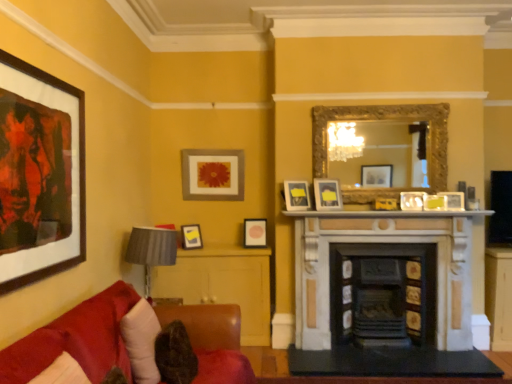
The height and width of the screenshot is (384, 512). I want to click on gray fabric lampshade at left, so click(151, 251).

Where is `matte white picture frame at center-right, which is counted as the first picture frame, starting from the right`? matte white picture frame at center-right, which is counted as the first picture frame, starting from the right is located at coordinates (453, 200).

What are the coordinates of `gray fabric lampshade at left` in the screenshot? It's located at (151, 251).

Is point (244, 235) positioned behind point (191, 234)?

Yes, point (244, 235) is behind point (191, 234).

From a real-world perspective, is matte black picture frame at center, the 5th picture frame viewed from the right, on top of matte black picture frame at center, acting as the 7th picture frame starting from the right?

Indeed, from a real-world perspective, matte black picture frame at center, the 5th picture frame viewed from the right, stands above matte black picture frame at center, acting as the 7th picture frame starting from the right.

Considering the relative sizes of matte black picture frame at center, the 5th picture frame viewed from the right, and matte black picture frame at center, placed as the third picture frame when sorted from back to front, in the image provided, is matte black picture frame at center, the 5th picture frame viewed from the right, taller than matte black picture frame at center, placed as the third picture frame when sorted from back to front,?

Indeed, matte black picture frame at center, the 5th picture frame viewed from the right, has a greater height compared to matte black picture frame at center, placed as the third picture frame when sorted from back to front.

Can you tell me how much matte black picture frame at center, marked as the fifth picture frame in a left-to-right arrangement, and gold ornate mirror at upper center differ in facing direction?

18.5 degrees separate the facing orientations of matte black picture frame at center, marked as the fifth picture frame in a left-to-right arrangement, and gold ornate mirror at upper center.

Can you confirm if matte black picture frame at center, which is the 4th picture frame from right to left, is taller than gold ornate mirror at upper center?

Incorrect, the height of matte black picture frame at center, which is the 4th picture frame from right to left, is not larger of that of gold ornate mirror at upper center.

Is matte black picture frame at center, marked as the fifth picture frame in a left-to-right arrangement, looking in the opposite direction of gold ornate mirror at upper center?

No, matte black picture frame at center, marked as the fifth picture frame in a left-to-right arrangement, is not facing away from gold ornate mirror at upper center.

Is matte black picture frame at center, which is counted as the 5th picture frame, starting from the back, outside of gold ornate mirror at upper center?

matte black picture frame at center, which is counted as the 5th picture frame, starting from the back, is positioned outside gold ornate mirror at upper center.

Considering the positions of points (317, 108) and (252, 338), is point (317, 108) farther from camera compared to point (252, 338)?

No.

Would you say gold ornate mirror at upper center is outside wooden cabinet at lower center, the 2th table from the front?

That's correct, gold ornate mirror at upper center is outside of wooden cabinet at lower center, the 2th table from the front.

Looking at this image, is wooden cabinet at lower center, the 2th table from the front, at the back of gold ornate mirror at upper center?

No, wooden cabinet at lower center, the 2th table from the front, is not at the back of gold ornate mirror at upper center.

From a real-world perspective, who is located lower, gold ornate mirror at upper center or wooden cabinet at lower center, which is counted as the second table, starting from the bottom?

wooden cabinet at lower center, which is counted as the second table, starting from the bottom, is physically lower.

Does black marble table at center, which is counted as the first table, starting from the right, appear on the right side of matte white picture frame at center, which appears as the fifth picture frame when viewed from the front?

No, black marble table at center, which is counted as the first table, starting from the right, is not to the right of matte white picture frame at center, which appears as the fifth picture frame when viewed from the front.

Does black marble table at center, which appears as the 1th table when viewed from the front, turn towards matte white picture frame at center, which appears as the fifth picture frame when viewed from the front?

No.

Consider the image. Is black marble table at center, which is counted as the 2th table, starting from the left, wider than matte white picture frame at center, which is counted as the 4th picture frame, starting from the back?

Yes.

Which object is more forward, black marble table at center, which is counted as the second table, starting from the top, or matte white picture frame at center, which appears as the fifth picture frame when viewed from the front?

black marble table at center, which is counted as the second table, starting from the top, is closer to the camera.

Where is `table in front of the wooden cabinet at lower center, the 2th table from the front`? The width and height of the screenshot is (512, 384). table in front of the wooden cabinet at lower center, the 2th table from the front is located at coordinates (356, 377).

Consider the image. Which is nearer, (253, 317) or (259, 356)?

The point (259, 356) is closer to the camera.

Does wooden cabinet at lower center, which is counted as the second table, starting from the bottom, have a lesser width compared to black marble table at center, which is counted as the first table, starting from the right?

Yes, wooden cabinet at lower center, which is counted as the second table, starting from the bottom, is thinner than black marble table at center, which is counted as the first table, starting from the right.

What's the angular difference between wooden cabinet at lower center, placed as the 1th table when sorted from top to bottom, and black marble table at center, which is counted as the 2th table, starting from the left,'s facing directions?

The angle between the facing direction of wooden cabinet at lower center, placed as the 1th table when sorted from top to bottom, and the facing direction of black marble table at center, which is counted as the 2th table, starting from the left, is 1.68 degrees.

Which is in front, matte black picture frame at center, the 7th picture frame when ordered from front to back, or white fabric pillow at lower left?

Positioned in front is white fabric pillow at lower left.

From the image's perspective, which one is positioned lower, matte black picture frame at center, the 5th picture frame viewed from the right, or white fabric pillow at lower left?

white fabric pillow at lower left.

Is matte black picture frame at center, the 7th picture frame when ordered from front to back, not near white fabric pillow at lower left?

That's right, there is a large distance between matte black picture frame at center, the 7th picture frame when ordered from front to back, and white fabric pillow at lower left.

Consider the image. Is matte black picture frame at center, the 4th picture frame viewed from the left, positioned with its back to white fabric pillow at lower left?

matte black picture frame at center, the 4th picture frame viewed from the left, does not have its back to white fabric pillow at lower left.

Which object is closer to the camera, matte black picture frame at left, acting as the first picture frame starting from the front, or matte black picture frame at center, which is counted as the 5th picture frame, starting from the back?

matte black picture frame at left, acting as the first picture frame starting from the front, is more forward.

Between matte black picture frame at left, placed as the first picture frame when sorted from left to right, and matte black picture frame at center, marked as the fifth picture frame in a left-to-right arrangement, which one appears on the left side from the viewer's perspective?

Positioned to the left is matte black picture frame at left, placed as the first picture frame when sorted from left to right.

Is matte black picture frame at left, placed as the first picture frame when sorted from left to right, next to matte black picture frame at center, which is the 4th picture frame from right to left?

No, matte black picture frame at left, placed as the first picture frame when sorted from left to right, is not in contact with matte black picture frame at center, which is the 4th picture frame from right to left.

The width and height of the screenshot is (512, 384). There is a matte black picture frame at left, arranged as the 8th picture frame when viewed from the right. What are the coordinates of `the 1st picture frame below it (from a real-world perspective)` in the screenshot? It's located at (297, 195).

In order to click on picture frame below the matte black picture frame at center, the 5th picture frame viewed from the right (from the image's perspective) in this screenshot , I will do `click(191, 236)`.

At what (x,y) coordinates should I click in order to perform the action: click on picture frame that is the 2nd one when counting forward from the gold ornate mirror at upper center. Please return your answer as a coordinate pair (x, y). This screenshot has width=512, height=384. Looking at the image, I should click on (297, 195).

Looking at the image, which one is located closer to matte black picture frame at left, positioned as the eighth picture frame in back-to-front order, matte black picture frame at center, the 4th picture frame viewed from the left, or dark gray stone fireplace at center, positioned as the first fireplace in right-to-left order?

matte black picture frame at center, the 4th picture frame viewed from the left, is positioned closer to the anchor matte black picture frame at left, positioned as the eighth picture frame in back-to-front order.

Based on their spatial positions, is dark gray stone fireplace at center, positioned as the first fireplace in right-to-left order, or gold ornate mirror at upper center further from white marble fireplace at center?

Based on the image, dark gray stone fireplace at center, positioned as the first fireplace in right-to-left order, appears to be further to white marble fireplace at center.

When comparing their distances from matte black picture frame at left, placed as the first picture frame when sorted from left to right, does gray fabric lampshade at left or matte white picture frame at center-right, the 8th picture frame positioned from the left, seem closer?

Based on the image, gray fabric lampshade at left appears to be nearer to matte black picture frame at left, placed as the first picture frame when sorted from left to right.

Looking at the image, which one is located further to matte white picture frame at center, marked as the 3th picture frame in a front-to-back arrangement, matte gold picture frame at upper center, which appears as the first picture frame when viewed from the back, or matte black picture frame at center, acting as the 7th picture frame starting from the right?

Among the two, matte black picture frame at center, acting as the 7th picture frame starting from the right, is located further to matte white picture frame at center, marked as the 3th picture frame in a front-to-back arrangement.

Which object lies further to the anchor point white fabric pillow at lower left, velvet red couch at lower left or matte black picture frame at center, the 5th picture frame viewed from the right?

The object further to white fabric pillow at lower left is matte black picture frame at center, the 5th picture frame viewed from the right.

Looking at the image, which one is located closer to matte black picture frame at center, marked as the fifth picture frame in a left-to-right arrangement, gray fabric lampshade at left or white fabric pillow at lower left?

Among the two, gray fabric lampshade at left is located nearer to matte black picture frame at center, marked as the fifth picture frame in a left-to-right arrangement.

Which object lies nearer to the anchor point matte gold picture frame at upper center, acting as the 8th picture frame starting from the front, matte white picture frame at center, which appears as the fifth picture frame when viewed from the front, or matte black picture frame at center, positioned as the 4th picture frame in front-to-back order?

matte black picture frame at center, positioned as the 4th picture frame in front-to-back order, lies closer to matte gold picture frame at upper center, acting as the 8th picture frame starting from the front, than the other object.

From the image, which object appears to be farther from matte white picture frame at center, which is counted as the 4th picture frame, starting from the back, dark gray stone fireplace at center, positioned as the first fireplace in right-to-left order, or velvet red couch at lower left?

velvet red couch at lower left.

This screenshot has height=384, width=512. I want to click on pillow between gray fabric lampshade at left and gold ornate mirror at upper center in the horizontal direction, so click(141, 341).

Locate an element on the screen. This screenshot has height=384, width=512. mirror positioned between velvet red couch at lower left and wooden cabinet at lower center, the first table viewed from the back, from near to far is located at coordinates (386, 119).

Where is `fireplace located between gray fabric lampshade at left and dark gray stone fireplace at center, the second fireplace from the left, in the left-right direction`? This screenshot has height=384, width=512. fireplace located between gray fabric lampshade at left and dark gray stone fireplace at center, the second fireplace from the left, in the left-right direction is located at coordinates (384, 294).

Where is `mantle between matte black picture frame at center, the 5th picture frame viewed from the right, and matte white picture frame at center-right, the 8th picture frame positioned from the left, in the horizontal direction`? Image resolution: width=512 pixels, height=384 pixels. mantle between matte black picture frame at center, the 5th picture frame viewed from the right, and matte white picture frame at center-right, the 8th picture frame positioned from the left, in the horizontal direction is located at coordinates (386, 214).